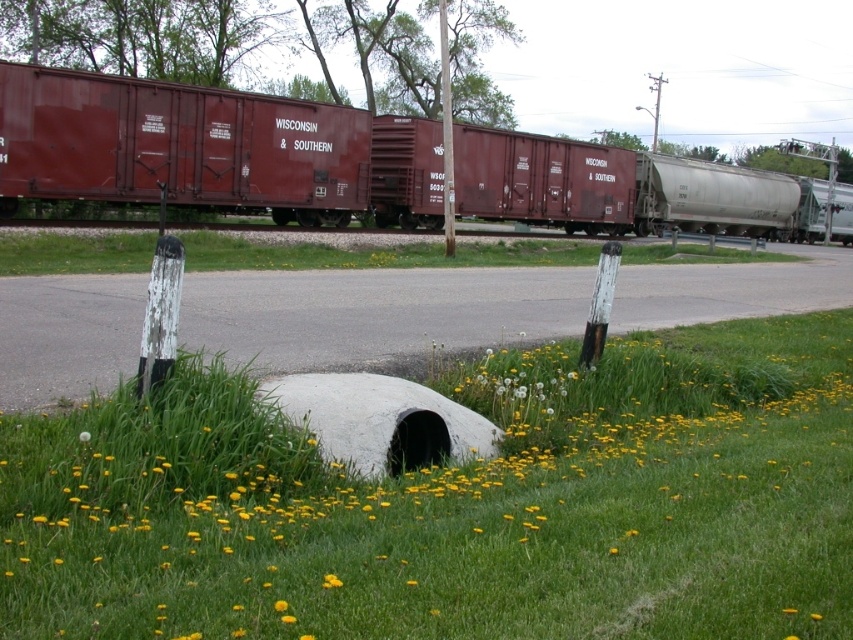
You are standing at the point with coordinates point (280, 602) and want to walk to the point with coordinates point (407, 198). Which direction should you face to move towards your destination?

You should face north because point (407, 198) is behind point (280, 602).

You are a train engineer approaching the crossing. You notice the yellow matte flower at lower center and the silver metallic tanker at right. Is the tanker blocking the flower from view?

The silver metallic tanker at right is positioned over yellow matte flower at lower center, so yes, the tanker is blocking the flower from view.